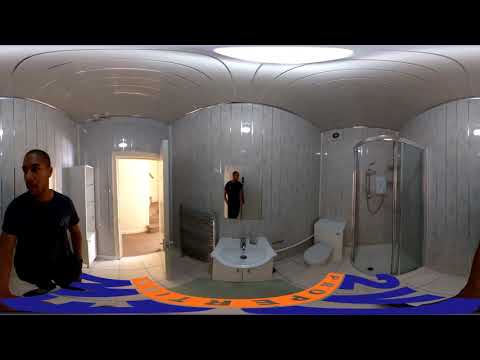
Where is `mirror`? The width and height of the screenshot is (480, 360). mirror is located at coordinates (256, 171).